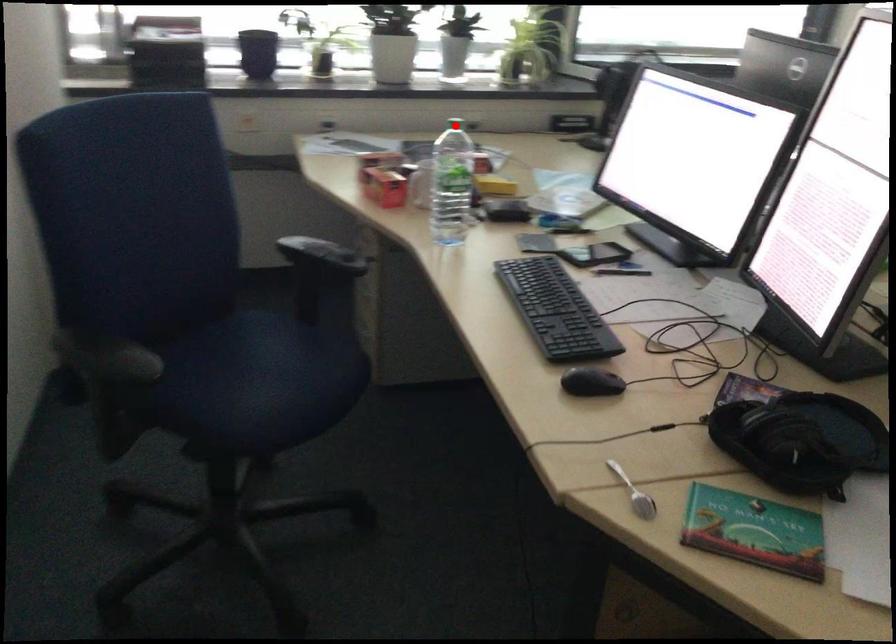
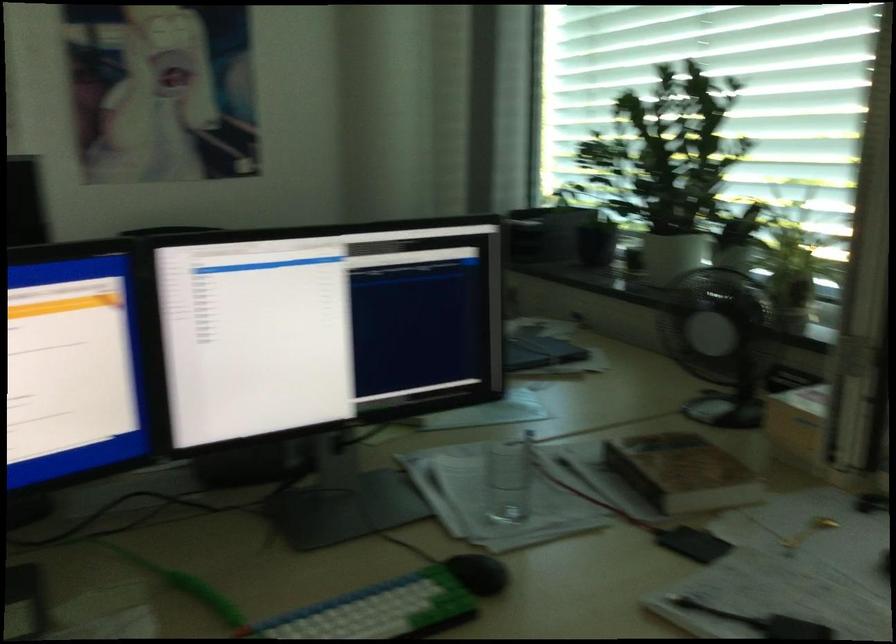
Question: I am providing you with two images of the same scene from different viewpoints. A red point is marked on the first image. Can you still see the location of the red point in image 2?

Choices:
 (A) Yes
 (B) No

Answer: (B)